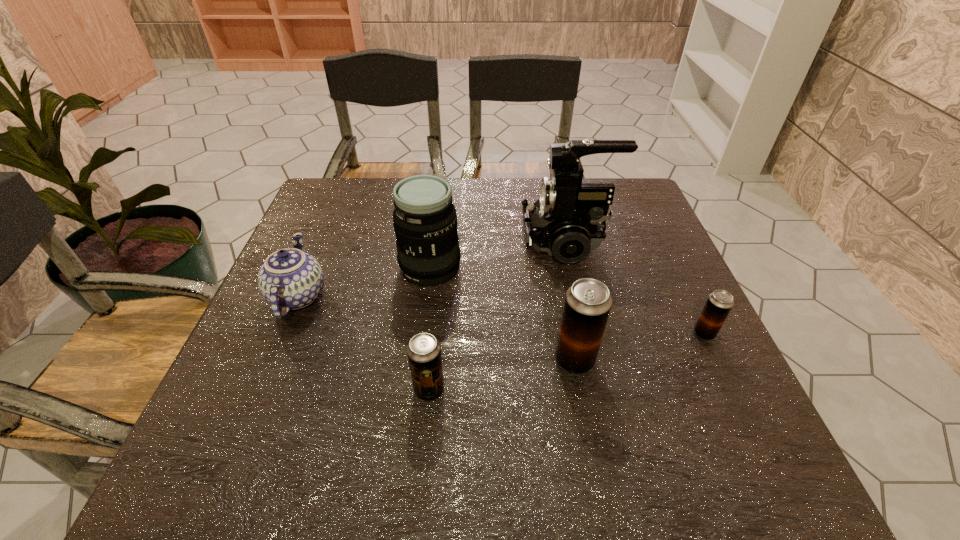
Where is `free point between the second nearest object and the nearest beer can`? free point between the second nearest object and the nearest beer can is located at coordinates (502, 375).

Where is `vacant point located between the farthest beer can and the tallest beer can`? This screenshot has width=960, height=540. vacant point located between the farthest beer can and the tallest beer can is located at coordinates (639, 347).

What are the coordinates of `blank region between the tallest object and the nearest object` in the screenshot? It's located at (498, 315).

Where is `object that is the third nearest to the second nearest beer can`? The width and height of the screenshot is (960, 540). object that is the third nearest to the second nearest beer can is located at coordinates (567, 221).

Image resolution: width=960 pixels, height=540 pixels. In order to click on object that is the fifth closest to the camcorder in this screenshot , I will do `click(291, 279)`.

Point out which beer can is positioned as the third nearest to the telephoto lens. Please provide its 2D coordinates. Your answer should be formatted as a tuple, i.e. [(x, y)], where the tuple contains the x and y coordinates of a point satisfying the conditions above.

[(719, 303)]

Identify the location of beer can that is the third nearest to the tallest object. click(424, 351).

Locate an element on the screen. This screenshot has height=540, width=960. vacant space that satisfies the following two spatial constraints: 1. on the lens mount of the camcorder; 2. on the right side of the shortest object is located at coordinates 588,333.

Locate an element on the screen. Image resolution: width=960 pixels, height=540 pixels. free space that satisfies the following two spatial constraints: 1. on the back side of the rightmost beer can; 2. on the right side of the third tallest object is located at coordinates (569, 333).